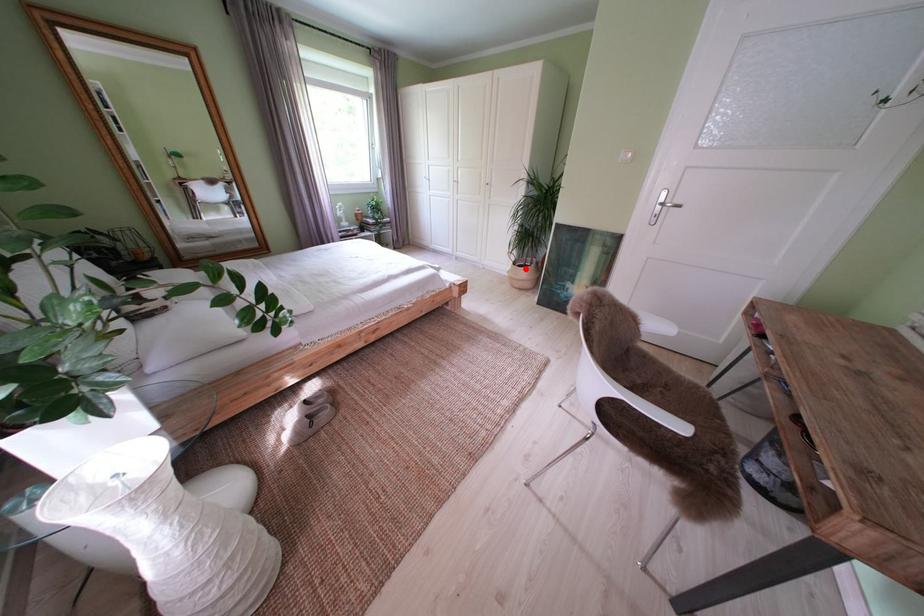
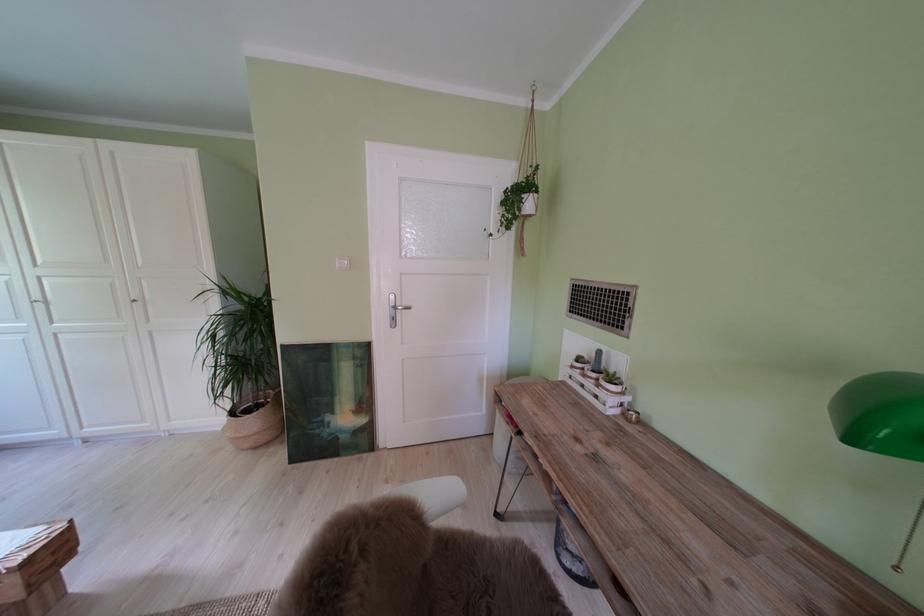
The point at the highlighted location is marked in the first image. Where is the corresponding point in the second image?

(242, 418)